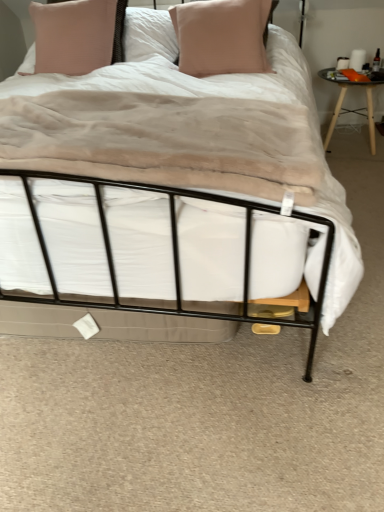
Question: Looking at their shapes, would you say black metal bed at center is wider or thinner than matte pink pillow at upper center, which ranks as the 2th pillow in right-to-left order?

Choices:
 (A) wide
 (B) thin

Answer: (A)

Question: From the image's perspective, is black metal bed at center located above or below matte pink pillow at upper center, which ranks as the 2th pillow in right-to-left order?

Choices:
 (A) below
 (B) above

Answer: (A)

Question: Which of these objects is positioned farthest from the pink fabric pillow at center, placed as the 2th pillow when sorted from left to right?

Choices:
 (A) black metal bed at center
 (B) black glass table at right
 (C) matte pink pillow at upper center, which ranks as the 2th pillow in right-to-left order

Answer: (B)

Question: Estimate the real-world distances between objects in this image. Which object is closer to the black glass table at right?

Choices:
 (A) pink fabric pillow at center, placed as the first pillow when sorted from right to left
 (B) matte pink pillow at upper center, positioned as the 1th pillow in left-to-right order
 (C) black metal bed at center

Answer: (A)